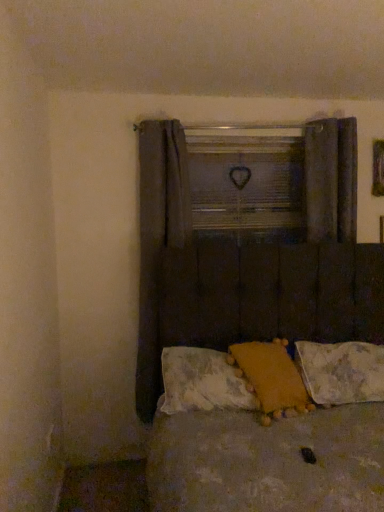
Question: Considering the positions of point (208, 334) and point (319, 239), is point (208, 334) closer or farther from the camera than point (319, 239)?

Choices:
 (A) farther
 (B) closer

Answer: (B)

Question: In terms of size, does brown tufted headboard at center appear bigger or smaller than dark fabric curtain at right, the second curtain positioned from the left?

Choices:
 (A) big
 (B) small

Answer: (A)

Question: Which object is the farthest from the dark fabric curtain at right, the second curtain positioned from the left?

Choices:
 (A) fluffy yellow pillow at center, arranged as the second pillow when viewed from the left
 (B) fluffy yellow pillow at center, which ranks as the first pillow in left-to-right order
 (C) fluffy white pillow at lower right, which appears as the 3th pillow when viewed from the left
 (D) brown tufted headboard at center
 (E) wooden heart at center

Answer: (B)

Question: Which object is positioned farthest from the wooden heart at center?

Choices:
 (A) dark fabric curtain at left, which is the second curtain from right to left
 (B) fluffy yellow pillow at center, which ranks as the first pillow in left-to-right order
 (C) dark fabric curtain at right, the second curtain positioned from the left
 (D) fluffy yellow pillow at center, arranged as the second pillow when viewed from the right
 (E) fluffy white pillow at lower right, which is counted as the first pillow, starting from the right

Answer: (B)